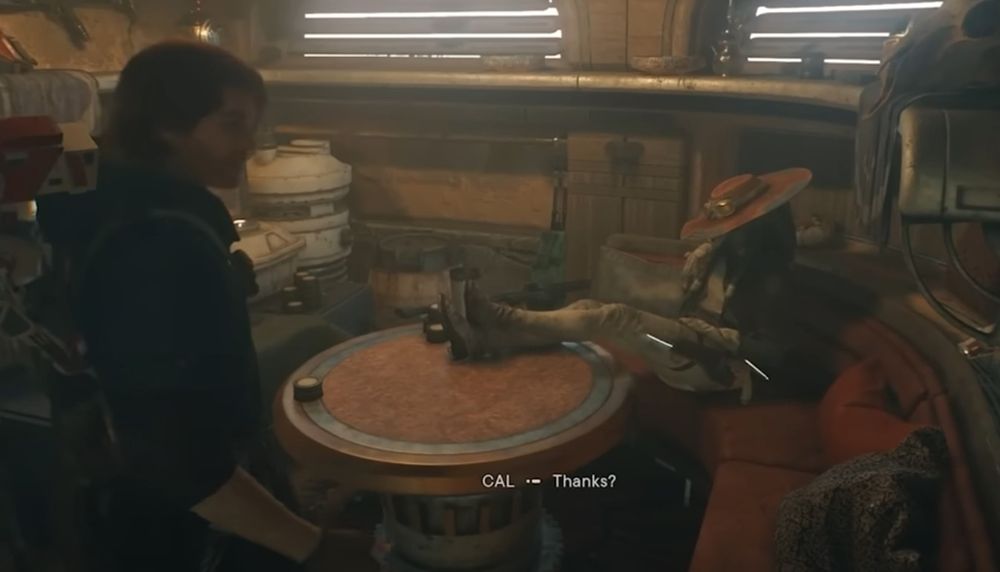
Locate an element on the screen. This screenshot has width=1000, height=572. light is located at coordinates (202, 29).